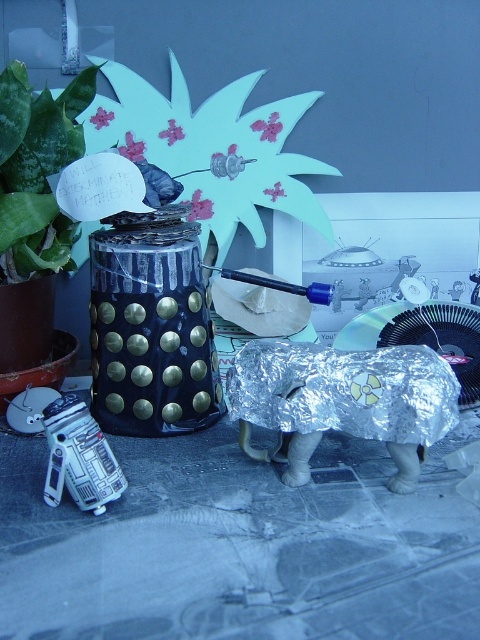
Question: Which of the following is the closest to the observer?

Choices:
 (A) (28, 218)
 (B) (61, 433)
 (C) (255, 348)

Answer: (B)

Question: Based on their relative distances, which object is nearer to the green leafy plant at upper left?

Choices:
 (A) shiny metallic elephant at lower right
 (B) silver metallic r2-d2 at lower left

Answer: (B)

Question: Does shiny metallic elephant at lower right have a larger size compared to green leafy plant at upper left?

Choices:
 (A) yes
 (B) no

Answer: (B)

Question: Which point is farther from the camera taking this photo?

Choices:
 (A) (17, 61)
 (B) (75, 445)

Answer: (A)

Question: Does shiny metallic elephant at lower right appear under green leafy plant at upper left?

Choices:
 (A) yes
 (B) no

Answer: (A)

Question: Can you confirm if shiny metallic elephant at lower right is positioned to the left of silver metallic r2-d2 at lower left?

Choices:
 (A) no
 (B) yes

Answer: (A)